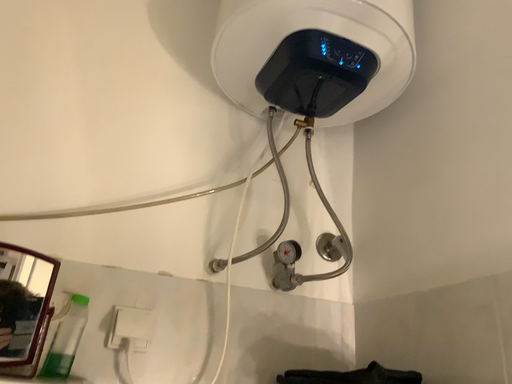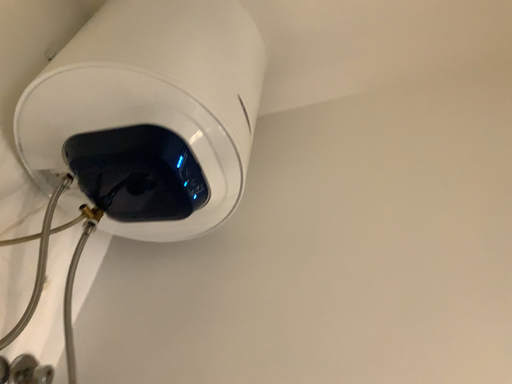
Question: Which way did the camera rotate in the video?

Choices:
 (A) rotated right
 (B) rotated left

Answer: (A)